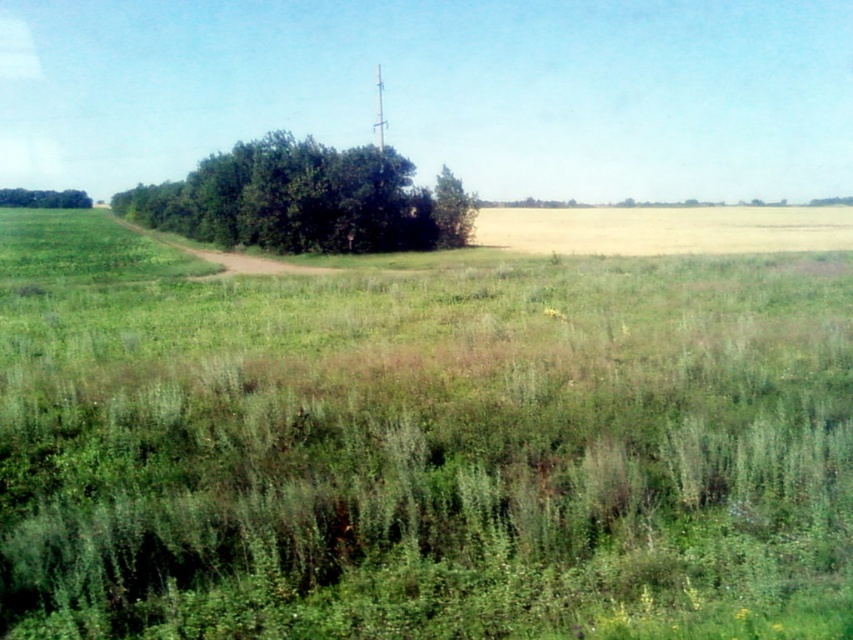
Does green leafy tree at center have a larger size compared to green leafy tree at left?

Correct, green leafy tree at center is larger in size than green leafy tree at left.

Is green leafy tree at center in front of green leafy tree at left?

Yes, green leafy tree at center is in front of green leafy tree at left.

This screenshot has width=853, height=640. What do you see at coordinates (305, 200) in the screenshot? I see `green leafy tree at center` at bounding box center [305, 200].

This screenshot has height=640, width=853. I want to click on green leafy tree at center, so click(305, 200).